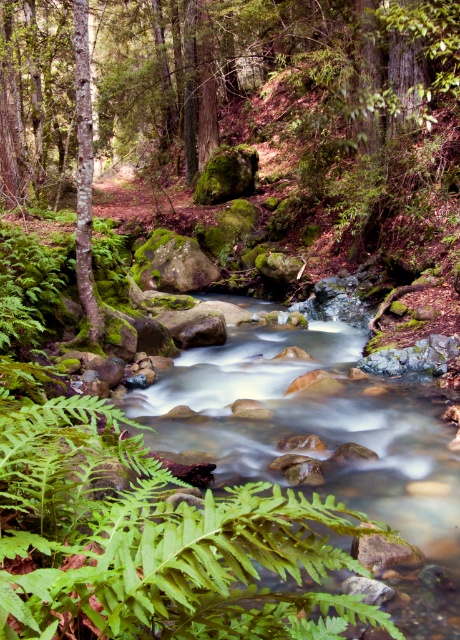
Can you confirm if green mossy tree at center is bigger than green mossy tree at left?

Yes, green mossy tree at center is bigger than green mossy tree at left.

Between green mossy tree at center and green mossy tree at left, which one has more height?

Standing taller between the two is green mossy tree at center.

Is point (171, 97) more distant than point (90, 148)?

Yes, it is behind point (90, 148).

Where is `green mossy tree at center`? Image resolution: width=460 pixels, height=640 pixels. green mossy tree at center is located at coordinates (242, 129).

Can you confirm if green mossy tree at center is positioned below green leafy fern at lower left?

No.

Does point (322, 212) lie behind point (69, 525)?

Yes, point (322, 212) is farther from viewer.

You are a GUI agent. You are given a task and a screenshot of the screen. Output one action in this format:
    pyautogui.click(x=<x>, y=<y>)
    Task: Click on the green mossy tree at center
    
    Given the screenshot: What is the action you would take?
    pyautogui.click(x=242, y=129)

Is green leafy fern at lower left further to camera compared to green mossy tree at left?

No, green leafy fern at lower left is closer to the viewer.

What do you see at coordinates (151, 545) in the screenshot?
I see `green leafy fern at lower left` at bounding box center [151, 545].

Between point (79, 490) and point (86, 280), which one is positioned in front?

Point (79, 490) is in front.

You are a GUI agent. You are given a task and a screenshot of the screen. Output one action in this format:
    pyautogui.click(x=<x>, y=<y>)
    Task: Click on the green leafy fern at lower left
    
    Given the screenshot: What is the action you would take?
    click(151, 545)